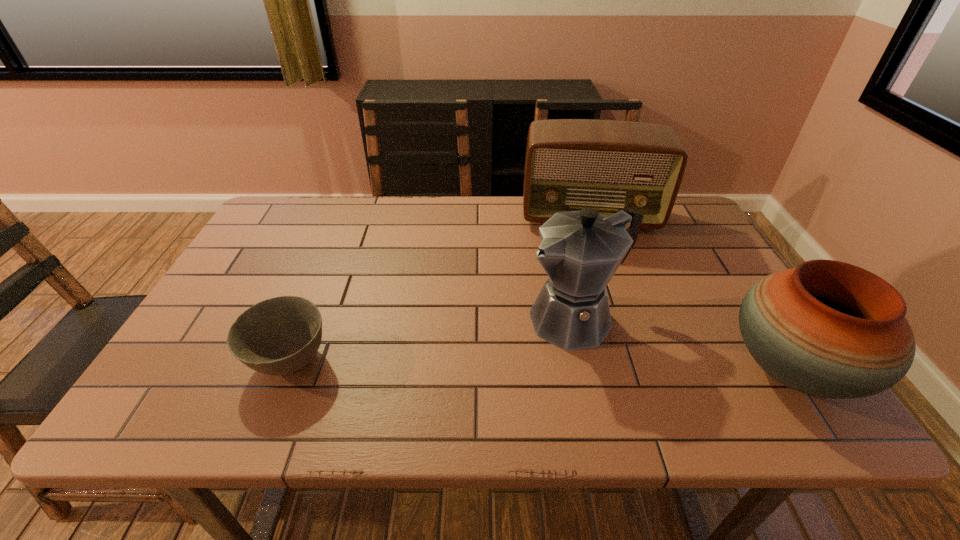
Locate an element on the screen. Image resolution: width=960 pixels, height=540 pixels. free space on the desktop that is between the leftmost object and the third tallest object and is positioned at the spout of the coffeepot is located at coordinates (486, 363).

The image size is (960, 540). In order to click on free space on the desktop that is between the bowl and the pottery and is positioned on the front-facing side of the farthest object in this screenshot , I will do `click(611, 366)`.